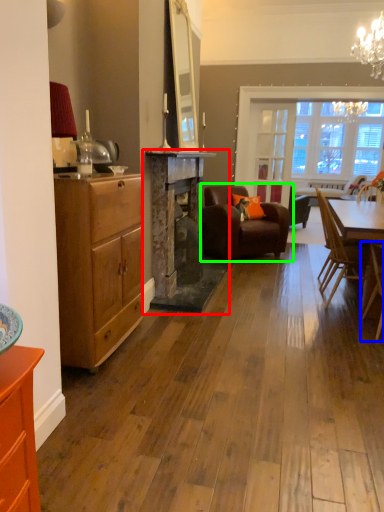
Question: Which object is positioned closest to fireplace (highlighted by a red box)? Select from chair (highlighted by a blue box) and chair (highlighted by a green box).

Choices:
 (A) chair
 (B) chair

Answer: (B)